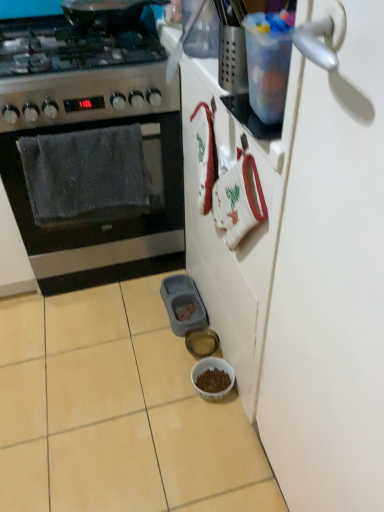
This screenshot has height=512, width=384. What do you see at coordinates (183, 304) in the screenshot?
I see `gray plastic pet food container at lower center` at bounding box center [183, 304].

Locate an element on the screen. brown matte bowl at lower center, which is counted as the 2th bowl, starting from the back is located at coordinates (212, 369).

Find the location of a particular element. The width and height of the screenshot is (384, 512). stainless steel oven at left is located at coordinates (89, 147).

You are a GUI agent. You are given a task and a screenshot of the screen. Output one action in this format:
    pyautogui.click(x=<x>, y=<y>)
    Task: Click on the gray plastic pet food container at lower center
    The height and width of the screenshot is (512, 384).
    Given the screenshot: What is the action you would take?
    pyautogui.click(x=183, y=304)

Image resolution: width=384 pixels, height=512 pixels. I want to click on the 1st bowl located beneath the white matte door at right (from a real-world perspective), so click(201, 342).

Is white matte door at right surrounding translucent glass bowl at lower center, the first bowl from the back?

Actually, translucent glass bowl at lower center, the first bowl from the back, is outside white matte door at right.

Is point (365, 283) behind point (197, 334)?

No, (365, 283) is closer to viewer.

Considering the relative positions of white matte door at right and translucent glass bowl at lower center, the first bowl from the back, in the image provided, is white matte door at right in front of translucent glass bowl at lower center, the first bowl from the back,?

Yes, the depth of white matte door at right is less than that of translucent glass bowl at lower center, the first bowl from the back.

In the image, is translucent glass bowl at lower center, the 2th bowl in the front-to-back sequence, positioned in front of or behind white matte door at right?

In the image, translucent glass bowl at lower center, the 2th bowl in the front-to-back sequence, appears behind white matte door at right.

Considering the relative sizes of translucent glass bowl at lower center, the 2th bowl in the front-to-back sequence, and white matte door at right in the image provided, is translucent glass bowl at lower center, the 2th bowl in the front-to-back sequence, wider than white matte door at right?

Indeed, translucent glass bowl at lower center, the 2th bowl in the front-to-back sequence, has a greater width compared to white matte door at right.

From the image's perspective, does translucent glass bowl at lower center, the 2th bowl in the front-to-back sequence, appear higher than white matte door at right?

No, from the image's perspective, translucent glass bowl at lower center, the 2th bowl in the front-to-back sequence, is not above white matte door at right.

Considering the relative positions of translucent glass bowl at lower center, the 2th bowl in the front-to-back sequence, and white matte door at right in the image provided, is translucent glass bowl at lower center, the 2th bowl in the front-to-back sequence, to the left or to the right of white matte door at right?

From the image, it's evident that translucent glass bowl at lower center, the 2th bowl in the front-to-back sequence, is to the left of white matte door at right.

From the image's perspective, is gray plastic pet food container at lower center located above or below white matte door at right?

From the image's perspective, gray plastic pet food container at lower center appears above white matte door at right.

Is gray plastic pet food container at lower center oriented towards white matte door at right?

No, gray plastic pet food container at lower center is not facing towards white matte door at right.

Image resolution: width=384 pixels, height=512 pixels. In order to click on appliance located underneath the white matte door at right (from a real-world perspective) in this screenshot , I will do `click(183, 304)`.

From the image's perspective, which one is positioned higher, stainless steel gas stove at left or translucent glass bowl at lower center, the first bowl from the back?

stainless steel gas stove at left, from the image's perspective.

Looking at this image, are stainless steel gas stove at left and translucent glass bowl at lower center, the 2th bowl in the front-to-back sequence, beside each other?

No.

Based on the photo, is stainless steel gas stove at left oriented away from translucent glass bowl at lower center, the 2th bowl in the front-to-back sequence?

No.

Does stainless steel gas stove at left have a greater height compared to translucent glass bowl at lower center, the first bowl from the back?

Indeed, stainless steel gas stove at left has a greater height compared to translucent glass bowl at lower center, the first bowl from the back.

From the image's perspective, who appears lower, white matte door at right or stainless steel gas stove at left?

white matte door at right.

Is white matte door at right not within stainless steel gas stove at left?

Yes, white matte door at right is located beyond the bounds of stainless steel gas stove at left.

From a real-world perspective, between white matte door at right and stainless steel gas stove at left, who is vertically higher?

In real-world perspective, stainless steel gas stove at left is above.

Does white matte door at right have a larger size compared to stainless steel gas stove at left?

Incorrect, white matte door at right is not larger than stainless steel gas stove at left.

Would you say white matte door at right contains brown matte bowl at lower center, which is counted as the 2th bowl, starting from the back?

No, brown matte bowl at lower center, which is counted as the 2th bowl, starting from the back, is not a part of white matte door at right.

Considering the sizes of objects white matte door at right and brown matte bowl at lower center, which is counted as the 2th bowl, starting from the back, in the image provided, who is shorter, white matte door at right or brown matte bowl at lower center, which is counted as the 2th bowl, starting from the back,?

Standing shorter between the two is brown matte bowl at lower center, which is counted as the 2th bowl, starting from the back.

Between white matte door at right and brown matte bowl at lower center, the 1th bowl when ordered from front to back, which one appears on the left side from the viewer's perspective?

brown matte bowl at lower center, the 1th bowl when ordered from front to back, is more to the left.

Does brown matte bowl at lower center, which is counted as the 2th bowl, starting from the back, lie behind stainless steel oven at left?

Yes, brown matte bowl at lower center, which is counted as the 2th bowl, starting from the back, is further from the camera.

Does brown matte bowl at lower center, which is counted as the 2th bowl, starting from the back, have a lesser height compared to stainless steel oven at left?

Yes, brown matte bowl at lower center, which is counted as the 2th bowl, starting from the back, is shorter than stainless steel oven at left.

From a real-world perspective, who is located lower, brown matte bowl at lower center, the 1th bowl when ordered from front to back, or stainless steel oven at left?

From a 3D spatial view, brown matte bowl at lower center, the 1th bowl when ordered from front to back, is below.

At what (x,y) coordinates should I click in order to perform the action: click on kitchen appliance on the left of brown matte bowl at lower center, which is counted as the 2th bowl, starting from the back. Please return your answer as a coordinate pair (x, y). The height and width of the screenshot is (512, 384). Looking at the image, I should click on (89, 147).

There is a translucent glass bowl at lower center, the 2th bowl in the front-to-back sequence. Identify the location of door above it (from a real-world perspective). coord(331,282).

In order to click on the 1st bowl below the white matte door at right (from the image's perspective) in this screenshot , I will do `click(201, 342)`.

Looking at the image, which one is located closer to translucent glass bowl at lower center, the first bowl from the back, stainless steel oven at left or white matte door at right?

stainless steel oven at left is positioned closer to the anchor translucent glass bowl at lower center, the first bowl from the back.

Which object lies further to the anchor point stainless steel oven at left, stainless steel gas stove at left or white matte door at right?

The object further to stainless steel oven at left is white matte door at right.

Considering their positions, is stainless steel oven at left positioned further to white matte door at right than gray plastic pet food container at lower center?

Based on the image, gray plastic pet food container at lower center appears to be further to white matte door at right.

Estimate the real-world distances between objects in this image. Which object is closer to stainless steel gas stove at left, gray plastic pet food container at lower center or white matte door at right?

The object closer to stainless steel gas stove at left is gray plastic pet food container at lower center.

When comparing their distances from stainless steel gas stove at left, does stainless steel oven at left or brown matte bowl at lower center, which is counted as the 2th bowl, starting from the back, seem further?

The object further to stainless steel gas stove at left is brown matte bowl at lower center, which is counted as the 2th bowl, starting from the back.

From the picture: Considering their positions, is brown matte bowl at lower center, which is counted as the 2th bowl, starting from the back, positioned closer to white matte door at right than stainless steel oven at left?

brown matte bowl at lower center, which is counted as the 2th bowl, starting from the back.

When comparing their distances from stainless steel gas stove at left, does translucent glass bowl at lower center, the first bowl from the back, or white matte door at right seem closer?

Based on the image, white matte door at right appears to be nearer to stainless steel gas stove at left.

From the image, which object appears to be farther from brown matte bowl at lower center, which is counted as the 2th bowl, starting from the back, stainless steel gas stove at left or white matte door at right?

Based on the image, stainless steel gas stove at left appears to be further to brown matte bowl at lower center, which is counted as the 2th bowl, starting from the back.

Image resolution: width=384 pixels, height=512 pixels. What are the coordinates of `gas stove positioned between white matte door at right and translucent glass bowl at lower center, the first bowl from the back, from near to far` in the screenshot? It's located at (78, 74).

Image resolution: width=384 pixels, height=512 pixels. What are the coordinates of `kitchen appliance that lies between stainless steel gas stove at left and brown matte bowl at lower center, the 1th bowl when ordered from front to back, from top to bottom` in the screenshot? It's located at (89, 147).

The height and width of the screenshot is (512, 384). Find the location of `bowl between white matte door at right and translucent glass bowl at lower center, the first bowl from the back, from front to back`. bowl between white matte door at right and translucent glass bowl at lower center, the first bowl from the back, from front to back is located at coordinates (212, 369).

Where is `kitchen appliance between white matte door at right and brown matte bowl at lower center, which is counted as the 2th bowl, starting from the back, along the z-axis`? This screenshot has width=384, height=512. kitchen appliance between white matte door at right and brown matte bowl at lower center, which is counted as the 2th bowl, starting from the back, along the z-axis is located at coordinates (89, 147).